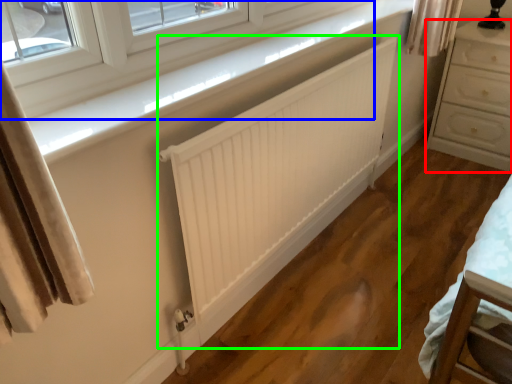
Question: Which is nearer to the chest of drawers (highlighted by a red box)? window (highlighted by a blue box) or radiator (highlighted by a green box).

Choices:
 (A) window
 (B) radiator

Answer: (B)